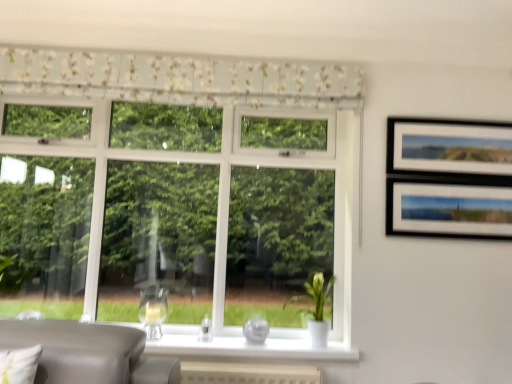
Question: Is floral fabric valance at upper center located within white glossy vase at lower center?

Choices:
 (A) yes
 (B) no

Answer: (B)

Question: Is white glossy vase at lower center oriented away from floral fabric valance at upper center?

Choices:
 (A) yes
 (B) no

Answer: (B)

Question: Would you say white glossy vase at lower center is a long distance from floral fabric valance at upper center?

Choices:
 (A) no
 (B) yes

Answer: (B)

Question: Is white glossy vase at lower center positioned beyond the bounds of floral fabric valance at upper center?

Choices:
 (A) yes
 (B) no

Answer: (A)

Question: Considering the relative sizes of white glossy vase at lower center and floral fabric valance at upper center in the image provided, is white glossy vase at lower center wider than floral fabric valance at upper center?

Choices:
 (A) yes
 (B) no

Answer: (A)

Question: Can you confirm if white glossy vase at lower center is smaller than floral fabric valance at upper center?

Choices:
 (A) yes
 (B) no

Answer: (A)

Question: Is floral fabric valance at upper center in front of white glossy vase at lower center?

Choices:
 (A) no
 (B) yes

Answer: (A)

Question: Is floral fabric valance at upper center at the right side of white glossy vase at lower center?

Choices:
 (A) no
 (B) yes

Answer: (A)

Question: Considering the relative sizes of floral fabric valance at upper center and white glossy vase at lower center in the image provided, is floral fabric valance at upper center taller than white glossy vase at lower center?

Choices:
 (A) no
 (B) yes

Answer: (A)

Question: From a real-world perspective, is floral fabric valance at upper center beneath white glossy vase at lower center?

Choices:
 (A) yes
 (B) no

Answer: (B)

Question: From a real-world perspective, is floral fabric valance at upper center on white glossy vase at lower center?

Choices:
 (A) no
 (B) yes

Answer: (B)

Question: Can white glossy vase at lower center be found inside floral fabric valance at upper center?

Choices:
 (A) yes
 (B) no

Answer: (B)

Question: Does floral fabric valance at upper center have a lesser width compared to transparent glass vase at center?

Choices:
 (A) no
 (B) yes

Answer: (B)